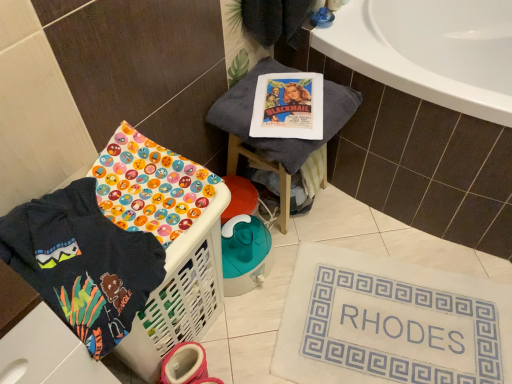
Question: From the image's perspective, is dark blue fabric at lower left below white fabric bath mat at lower right?

Choices:
 (A) no
 (B) yes

Answer: (A)

Question: Considering the relative positions of dark blue fabric at lower left and white fabric bath mat at lower right in the image provided, is dark blue fabric at lower left in front of white fabric bath mat at lower right?

Choices:
 (A) no
 (B) yes

Answer: (B)

Question: Can you confirm if dark blue fabric at lower left is shorter than white fabric bath mat at lower right?

Choices:
 (A) yes
 (B) no

Answer: (B)

Question: Considering the relative positions of dark blue fabric at lower left and white fabric bath mat at lower right in the image provided, is dark blue fabric at lower left to the left of white fabric bath mat at lower right from the viewer's perspective?

Choices:
 (A) no
 (B) yes

Answer: (B)

Question: Could you tell me if dark blue fabric at lower left is turned towards white fabric bath mat at lower right?

Choices:
 (A) yes
 (B) no

Answer: (B)

Question: Is dark blue fabric at lower left bigger than white fabric bath mat at lower right?

Choices:
 (A) no
 (B) yes

Answer: (A)

Question: Could you tell me if white plastic laundry basket at lower left is turned towards gray fabric stool at upper center?

Choices:
 (A) no
 (B) yes

Answer: (A)

Question: From the image's perspective, is white plastic laundry basket at lower left under gray fabric stool at upper center?

Choices:
 (A) no
 (B) yes

Answer: (B)

Question: Considering the relative positions of white plastic laundry basket at lower left and gray fabric stool at upper center in the image provided, is white plastic laundry basket at lower left in front of gray fabric stool at upper center?

Choices:
 (A) no
 (B) yes

Answer: (B)

Question: Is white plastic laundry basket at lower left looking in the opposite direction of gray fabric stool at upper center?

Choices:
 (A) yes
 (B) no

Answer: (B)

Question: Does white plastic laundry basket at lower left lie behind gray fabric stool at upper center?

Choices:
 (A) no
 (B) yes

Answer: (A)

Question: Is white plastic laundry basket at lower left positioned beyond the bounds of gray fabric stool at upper center?

Choices:
 (A) yes
 (B) no

Answer: (A)

Question: Can you confirm if gray fabric stool at upper center is bigger than dark blue fabric at lower left?

Choices:
 (A) yes
 (B) no

Answer: (A)